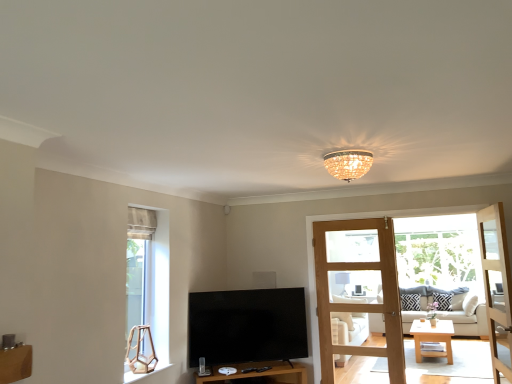
Where is `blank space above light brown wooden door at center, which ranks as the 2th door in right-to-left order (from a real-world perspective)`? This screenshot has width=512, height=384. blank space above light brown wooden door at center, which ranks as the 2th door in right-to-left order (from a real-world perspective) is located at coordinates (347, 219).